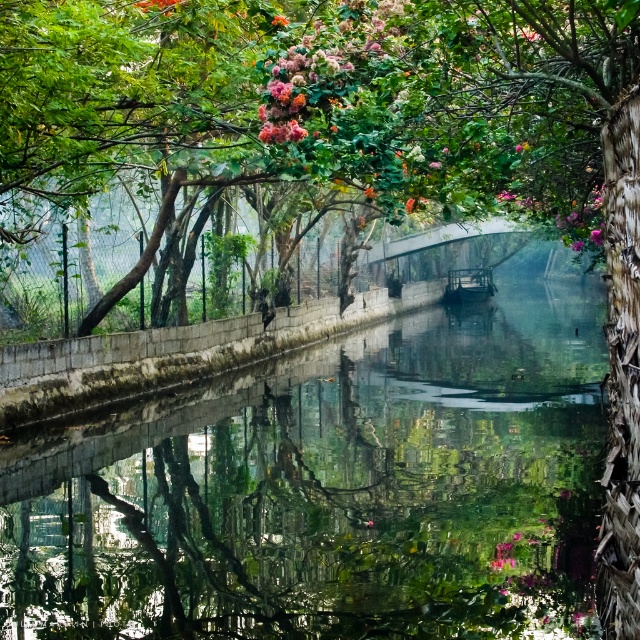
What do you see at coordinates (326, 70) in the screenshot? I see `pink fluffy flowers at upper center` at bounding box center [326, 70].

Can you confirm if pink fluffy flowers at upper center is taller than pink matte flower at upper center?

Correct, pink fluffy flowers at upper center is much taller as pink matte flower at upper center.

Which is in front, point (289, 132) or point (150, 3)?

Positioned in front is point (289, 132).

Where is `pink fluffy flowers at upper center`? pink fluffy flowers at upper center is located at coordinates (326, 70).

Is point (568, 227) farther from camera compared to point (144, 1)?

Yes, it is behind point (144, 1).

Does pink matte flower at upper right have a lesser height compared to pink matte flower at upper center?

No.

Who is more distant from viewer, (596, 221) or (161, 10)?

Positioned behind is point (596, 221).

The image size is (640, 640). I want to click on pink matte flower at upper right, so click(x=582, y=221).

Is point (339, 4) positioned before point (596, 204)?

Yes, point (339, 4) is closer to viewer.

Is point (388, 35) positioned after point (573, 225)?

No, (388, 35) is in front of (573, 225).

At what (x,y) coordinates should I click in order to perform the action: click on pink fluffy flowers at upper center. Please return your answer as a coordinate pair (x, y). Image resolution: width=640 pixels, height=640 pixels. Looking at the image, I should click on (326, 70).